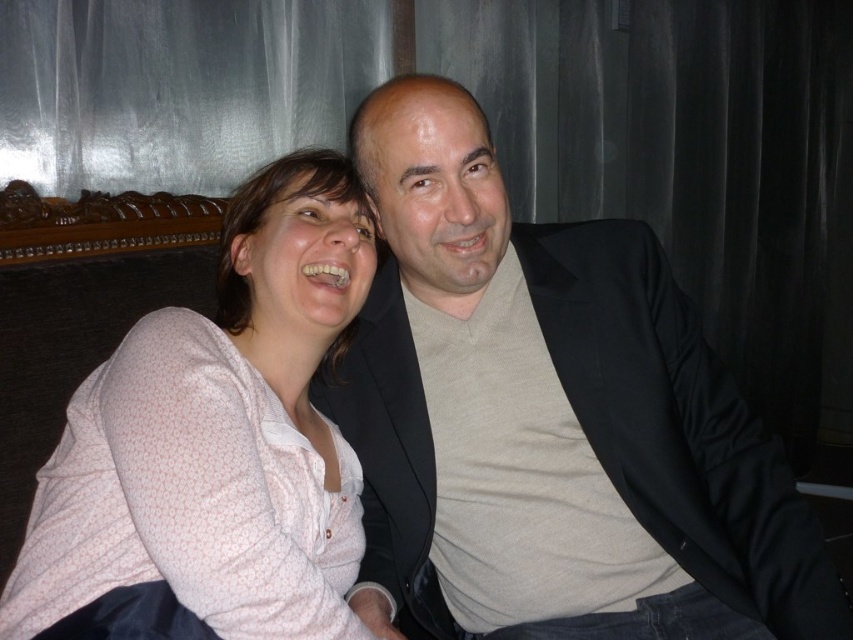
Question: Observing the image, what is the correct spatial positioning of matte black suit at center in reference to white dotted shirt at upper left?

Choices:
 (A) right
 (B) left

Answer: (A)

Question: Is matte black suit at center below white dotted shirt at upper left?

Choices:
 (A) no
 (B) yes

Answer: (B)

Question: Can you confirm if matte black suit at center is thinner than white dotted shirt at upper left?

Choices:
 (A) no
 (B) yes

Answer: (A)

Question: Which point is farther to the camera?

Choices:
 (A) white dotted shirt at upper left
 (B) matte black suit at center

Answer: (B)